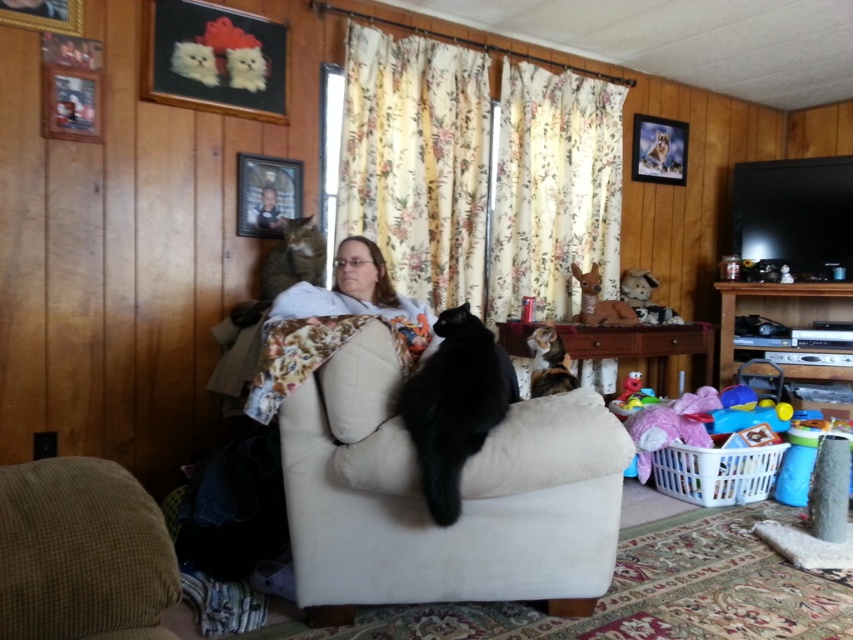
You are a photographer positioned at the camera. You want to take a closeup shot of the black fur cat at center. Considering your current position, is the distance sufficient to capture the cat clearly in the frame?

The black fur cat at center is 1.60 meters from the camera. Whether this distance is sufficient depends on the lens used. A standard lens might require moving closer, while a telephoto lens could capture the cat clearly from this distance. Adjust your equipment accordingly.

You are a visitor in this living room and want to pet both the beige fabric armchair at center and the black fur cat at center. Which one should you approach first if you want to reach the one closer to the floor?

The beige fabric armchair at center is located below the black fur cat at center, so you should approach the beige fabric armchair at center first since it is closer to the floor.

In the scene shown: You are a cat owner who wants to ensure your calico fur cat at center has enough space to move freely between the floral fabric curtain at center and the windowsill. Based on the scene, can the cat comfortably pass through the space between the curtain and the windowsill?

The floral fabric curtain at center is wider than the calico fur cat at center, so there is sufficient space for the cat to move freely between them.